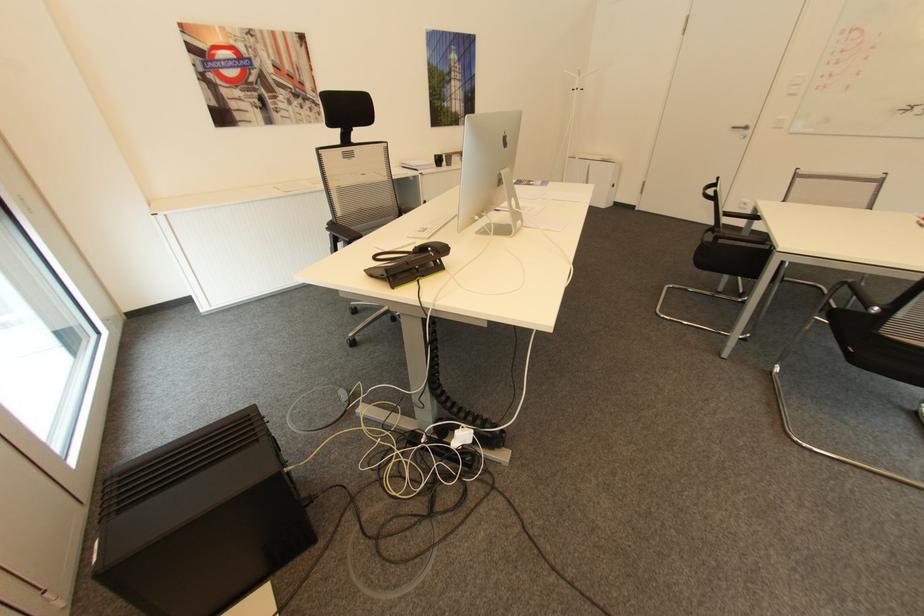
Where is `silver door handle`? The height and width of the screenshot is (616, 924). silver door handle is located at coordinates (740, 127).